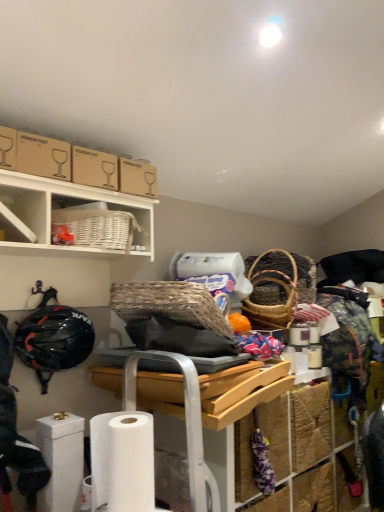
Question: Does matte cardboard box at upper left have a greater width compared to white wicker basket at upper left, positioned as the 2th shelf in right-to-left order?

Choices:
 (A) no
 (B) yes

Answer: (A)

Question: Is matte cardboard box at upper left aimed at white wicker basket at upper left, which ranks as the 1th shelf in left-to-right order?

Choices:
 (A) yes
 (B) no

Answer: (B)

Question: Is matte cardboard box at upper left next to white wicker basket at upper left, positioned as the 2th shelf in right-to-left order?

Choices:
 (A) yes
 (B) no

Answer: (B)

Question: Can you confirm if matte cardboard box at upper left is taller than white wicker basket at upper left, positioned as the 2th shelf in right-to-left order?

Choices:
 (A) no
 (B) yes

Answer: (A)

Question: Does matte cardboard box at upper left have a larger size compared to white wicker basket at upper left, which ranks as the 1th shelf in left-to-right order?

Choices:
 (A) no
 (B) yes

Answer: (A)

Question: From their relative heights in the image, would you say white matte toilet paper at lower left, the 1th toilet paper positioned from the front, is taller or shorter than white wicker basket at upper left, which ranks as the 1th shelf in left-to-right order?

Choices:
 (A) short
 (B) tall

Answer: (B)

Question: Visually, is white matte toilet paper at lower left, the 1th toilet paper positioned from the front, positioned to the left or to the right of white wicker basket at upper left, positioned as the 2th shelf in right-to-left order?

Choices:
 (A) left
 (B) right

Answer: (B)

Question: Considering the positions of white matte toilet paper at lower left, arranged as the second toilet paper when viewed from the left, and white wicker basket at upper left, which ranks as the 1th shelf in left-to-right order, in the image, is white matte toilet paper at lower left, arranged as the second toilet paper when viewed from the left, bigger or smaller than white wicker basket at upper left, which ranks as the 1th shelf in left-to-right order,?

Choices:
 (A) small
 (B) big

Answer: (A)

Question: From a real-world perspective, is white matte toilet paper at lower left, the second toilet paper positioned from the back, physically located above or below white wicker basket at upper left, positioned as the 2th shelf in right-to-left order?

Choices:
 (A) above
 (B) below

Answer: (B)

Question: In terms of height, does wooden tray at center look taller or shorter compared to black matte helmet at left?

Choices:
 (A) tall
 (B) short

Answer: (B)

Question: Is wooden tray at center bigger or smaller than black matte helmet at left?

Choices:
 (A) small
 (B) big

Answer: (B)

Question: Is wooden tray at center wider or thinner than black matte helmet at left?

Choices:
 (A) wide
 (B) thin

Answer: (A)

Question: From a real-world perspective, is wooden tray at center above or below black matte helmet at left?

Choices:
 (A) below
 (B) above

Answer: (A)

Question: From a real-world perspective, is brown cardboard box at upper left positioned above or below white wicker basket at upper center, the second shelf positioned from the left?

Choices:
 (A) above
 (B) below

Answer: (A)

Question: From the image's perspective, is brown cardboard box at upper left positioned above or below white wicker basket at upper center, which ranks as the first shelf in right-to-left order?

Choices:
 (A) above
 (B) below

Answer: (A)